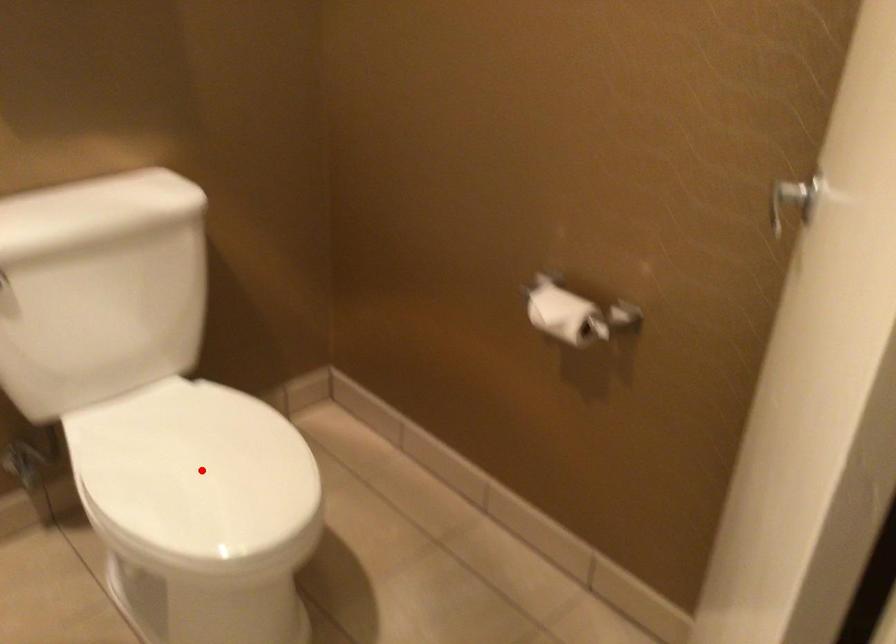
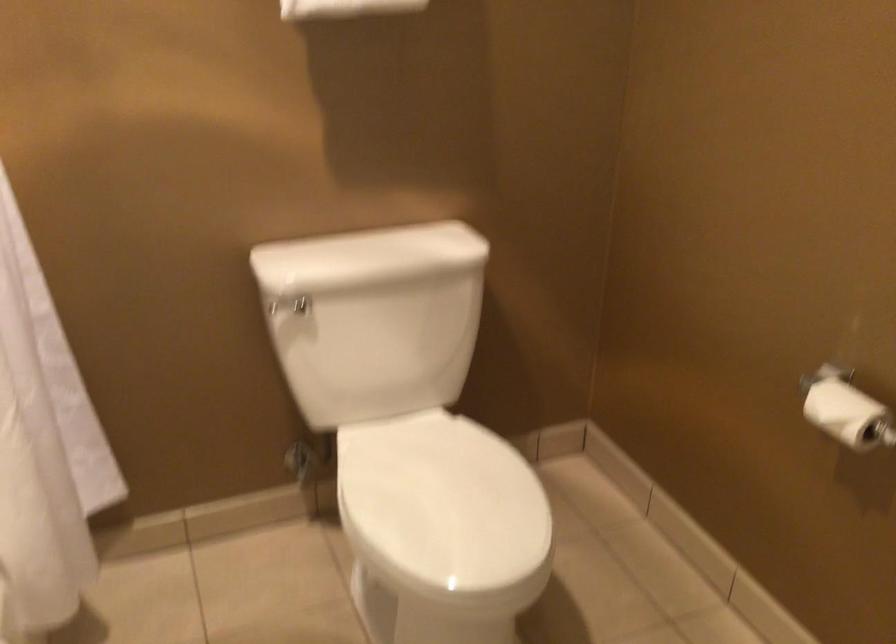
In the second image, find the point that corresponds to the highlighted location in the first image.

(442, 505)